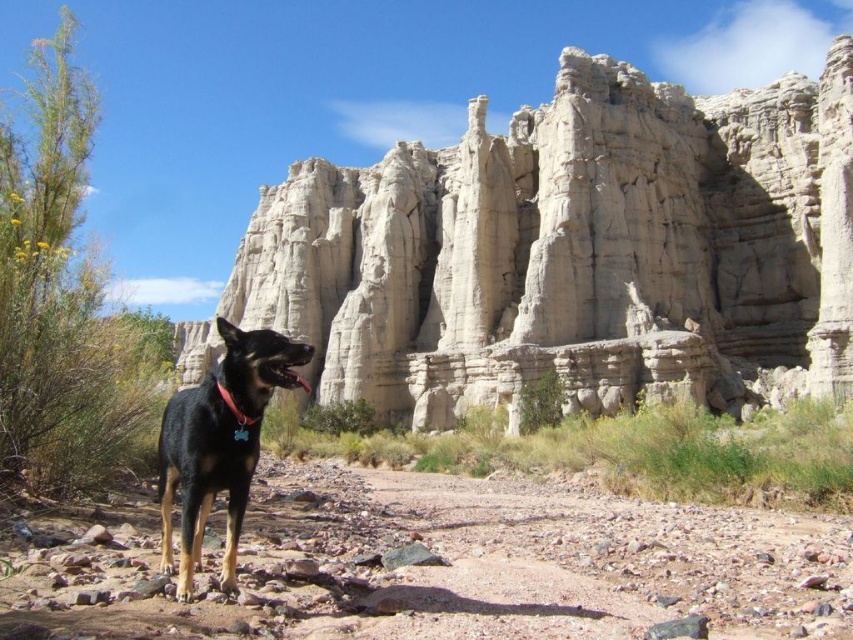
Based on the scene, what is the 2D coordinate of the smooth sandstone rock formation at center?

The smooth sandstone rock formation at center is located at the 2D coordinate point of (573, 250).

You are a photographer planning to take a photo of the black matte dog at center and the smooth sandstone rock formation at center. Based on their positions, which object is closer to the camera?

The smooth sandstone rock formation at center is closer to the camera because the black matte dog at center is positioned behind it.

You are a hiker who wants to walk along the brown gravelly dirt track at center. However, you notice the black matte dog at center is blocking your path. Can you walk around the dog to reach the track? Explain your reasoning.

The brown gravelly dirt track at center is to the right of the black matte dog at center. Since the track is positioned to the right of the dog, you can walk around the dog to the right side to reach the track.